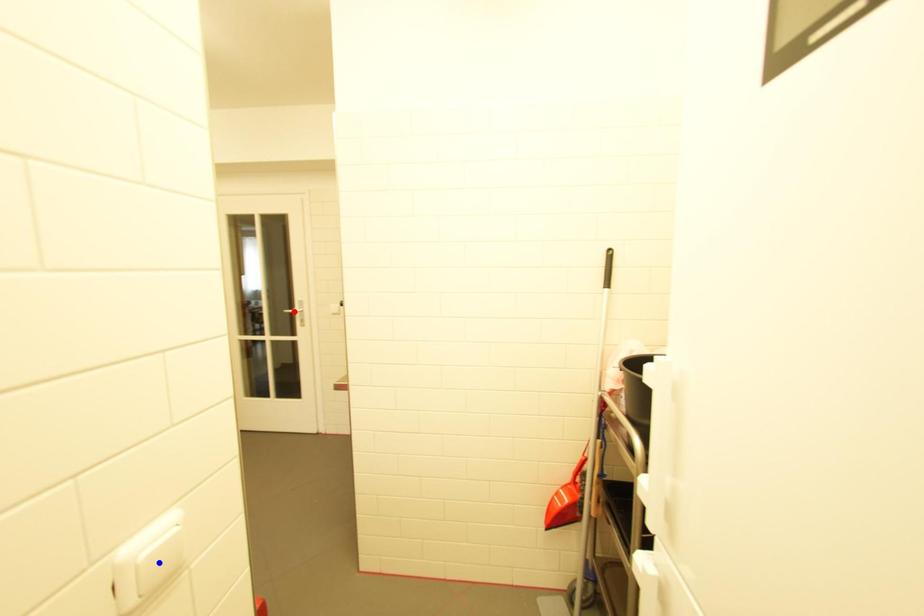
Question: Which of the two points in the image is closer to the camera?

Choices:
 (A) Blue point is closer.
 (B) Red point is closer.

Answer: (A)